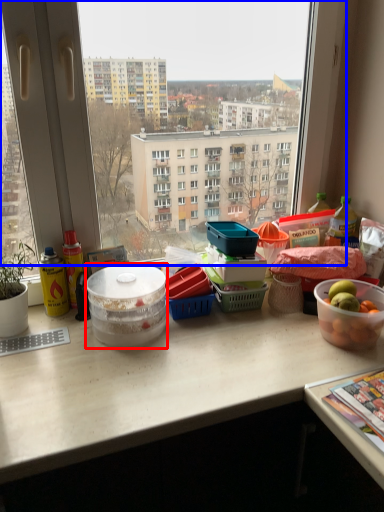
Question: Which point is further to the camera, bowl (highlighted by a red box) or window (highlighted by a blue box)?

Choices:
 (A) bowl
 (B) window

Answer: (A)